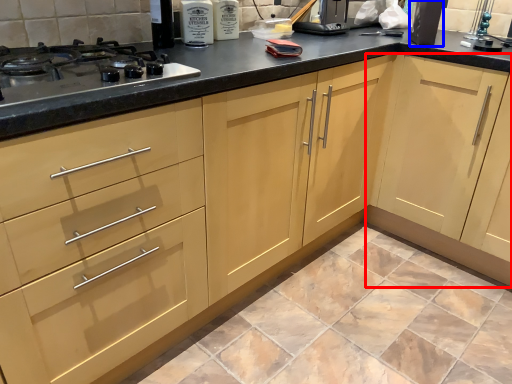
Question: Which object is closer to the camera taking this photo, cabinetry (highlighted by a red box) or appliance (highlighted by a blue box)?

Choices:
 (A) cabinetry
 (B) appliance

Answer: (A)